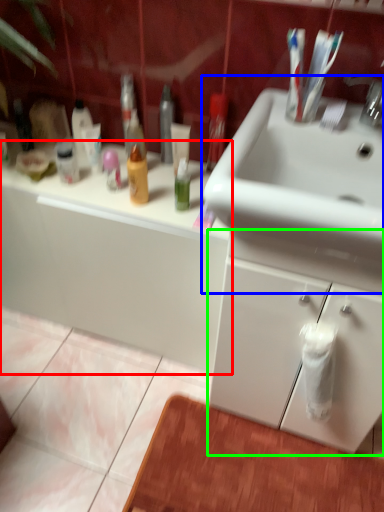
Question: Considering the real-world distances, which object is farthest from bathroom cabinet (highlighted by a red box)? sink (highlighted by a blue box) or bathroom cabinet (highlighted by a green box)?

Choices:
 (A) sink
 (B) bathroom cabinet

Answer: (A)